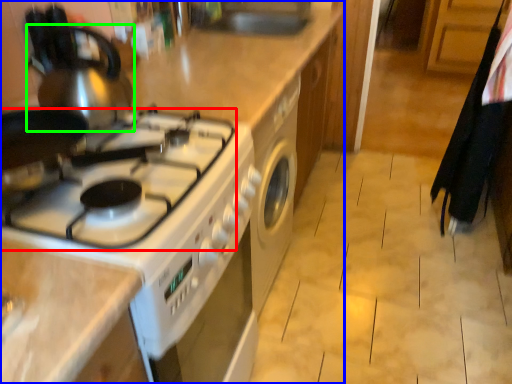
Question: Considering the real-world distances, which object is farthest from gas stove (highlighted by a red box)? kitchen appliance (highlighted by a blue box) or tea pot (highlighted by a green box)?

Choices:
 (A) kitchen appliance
 (B) tea pot

Answer: (A)